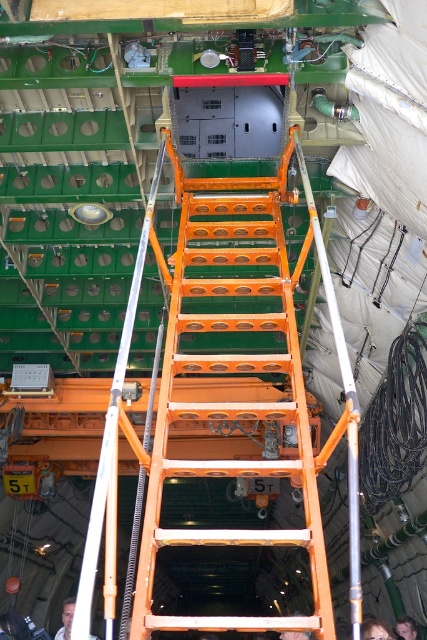
Question: Is light skin tone shirt at center smaller than smooth skin man at lower center?

Choices:
 (A) no
 (B) yes

Answer: (B)

Question: Among these objects, which one is farthest from the camera?

Choices:
 (A) dark brown leather jacket at lower right
 (B) smooth skin man at lower center
 (C) orange metallic ladder at center
 (D) light skin tone shirt at center

Answer: (A)

Question: Does dark brown leather jacket at lower right appear over smooth skin man at lower center?

Choices:
 (A) no
 (B) yes

Answer: (B)

Question: Which of the following is the farthest from the observer?

Choices:
 (A) (298, 634)
 (B) (69, 602)
 (C) (204, 273)

Answer: (C)

Question: Which object is positioned closest to the smooth skin man at lower center?

Choices:
 (A) orange metallic ladder at center
 (B) dark brown leather jacket at lower right

Answer: (B)

Question: Considering the relative positions of light skin tone shirt at center and smooth skin man at lower center in the image provided, where is light skin tone shirt at center located with respect to smooth skin man at lower center?

Choices:
 (A) left
 (B) right

Answer: (A)